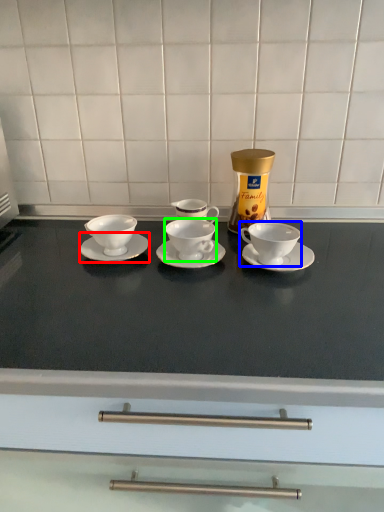
Question: Estimate the real-world distances between objects in this image. Which object is farther from saucer (highlighted by a red box), coffee cup (highlighted by a blue box) or coffee cup (highlighted by a green box)?

Choices:
 (A) coffee cup
 (B) coffee cup

Answer: (A)